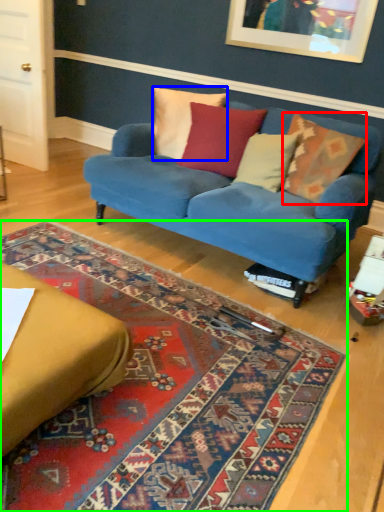
Question: Which object is the farthest from pillow (highlighted by a red box)? Choose among these: pillow (highlighted by a blue box) or mat (highlighted by a green box).

Choices:
 (A) pillow
 (B) mat

Answer: (B)